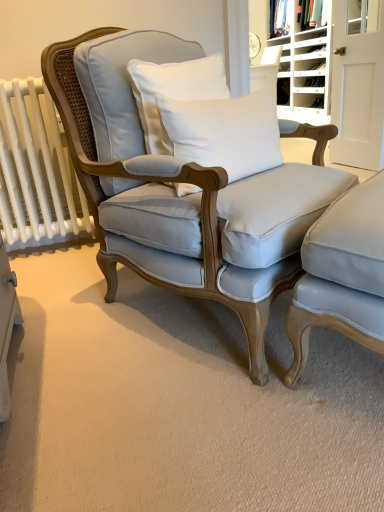
Question: Does white wood bookshelf at upper right appear on the left side of white cotton pillow at center, the 2th pillow in the top-to-bottom sequence?

Choices:
 (A) no
 (B) yes

Answer: (A)

Question: Is white wood bookshelf at upper right not inside white cotton pillow at center, the 2th pillow in the top-to-bottom sequence?

Choices:
 (A) no
 (B) yes

Answer: (B)

Question: From the image's perspective, is white wood bookshelf at upper right on top of white cotton pillow at center, the first pillow in the bottom-to-top sequence?

Choices:
 (A) yes
 (B) no

Answer: (A)

Question: Is white wood bookshelf at upper right looking in the opposite direction of white cotton pillow at center, the 2th pillow in the top-to-bottom sequence?

Choices:
 (A) no
 (B) yes

Answer: (A)

Question: Is white wood bookshelf at upper right facing towards white cotton pillow at center, the first pillow in the bottom-to-top sequence?

Choices:
 (A) no
 (B) yes

Answer: (A)

Question: From the image's perspective, does white wood bookshelf at upper right appear lower than white cotton pillow at center, the 2th pillow in the top-to-bottom sequence?

Choices:
 (A) yes
 (B) no

Answer: (B)

Question: Is white cotton pillow at center, the second pillow when ordered from bottom to top, smaller than satin light blue armchair at lower right, positioned as the first chair in right-to-left order?

Choices:
 (A) no
 (B) yes

Answer: (B)

Question: Is white cotton pillow at center, the second pillow when ordered from bottom to top, next to satin light blue armchair at lower right, positioned as the first chair in right-to-left order?

Choices:
 (A) no
 (B) yes

Answer: (A)

Question: From a real-world perspective, is white cotton pillow at center, the first pillow in the top-to-bottom sequence, beneath satin light blue armchair at lower right, positioned as the first chair in right-to-left order?

Choices:
 (A) yes
 (B) no

Answer: (B)

Question: Considering the relative sizes of white cotton pillow at center, the second pillow when ordered from bottom to top, and satin light blue armchair at lower right, positioned as the first chair in right-to-left order, in the image provided, is white cotton pillow at center, the second pillow when ordered from bottom to top, taller than satin light blue armchair at lower right, positioned as the first chair in right-to-left order,?

Choices:
 (A) yes
 (B) no

Answer: (B)

Question: Is white cotton pillow at center, the second pillow when ordered from bottom to top, shorter than satin light blue armchair at lower right, positioned as the first chair in right-to-left order?

Choices:
 (A) yes
 (B) no

Answer: (A)

Question: Can you confirm if white cotton pillow at center, the second pillow when ordered from bottom to top, is thinner than satin light blue armchair at lower right, acting as the second chair starting from the left?

Choices:
 (A) no
 (B) yes

Answer: (A)

Question: Is white plastic shoe rack at upper right at the back of light blue fabric chair at center, which appears as the first chair when viewed from the left?

Choices:
 (A) no
 (B) yes

Answer: (A)